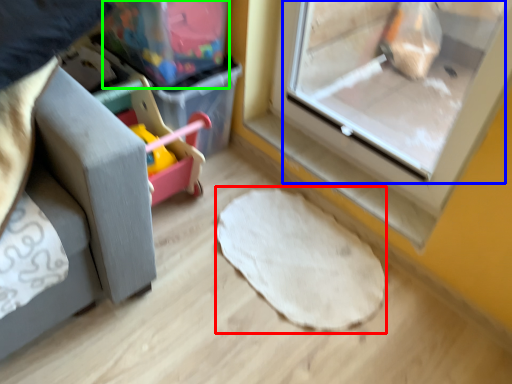
Question: Which object is the farthest from mat (highlighted by a red box)? Choose among these: screen door (highlighted by a blue box) or storage box (highlighted by a green box).

Choices:
 (A) screen door
 (B) storage box

Answer: (A)